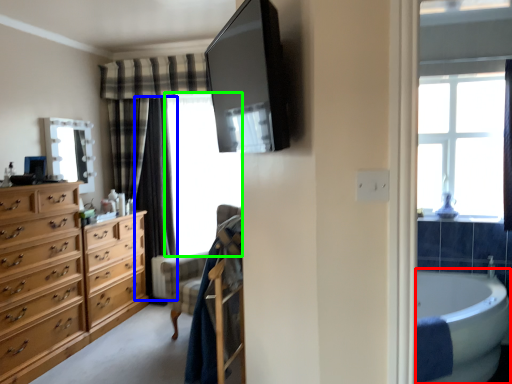
Question: Which object is positioned farthest from bath (highlighted by a red box)? Select from curtain (highlighted by a blue box) and window screen (highlighted by a green box).

Choices:
 (A) curtain
 (B) window screen

Answer: (A)